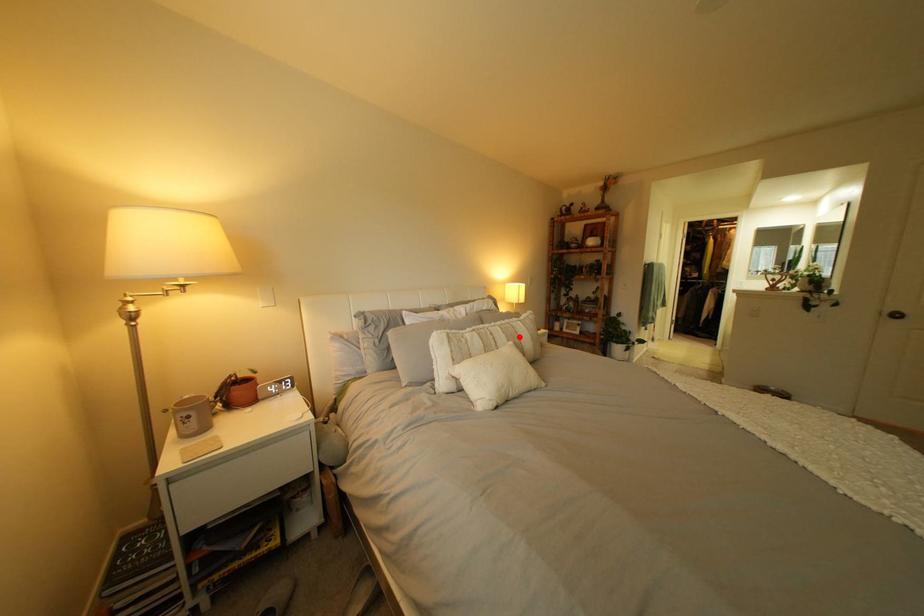
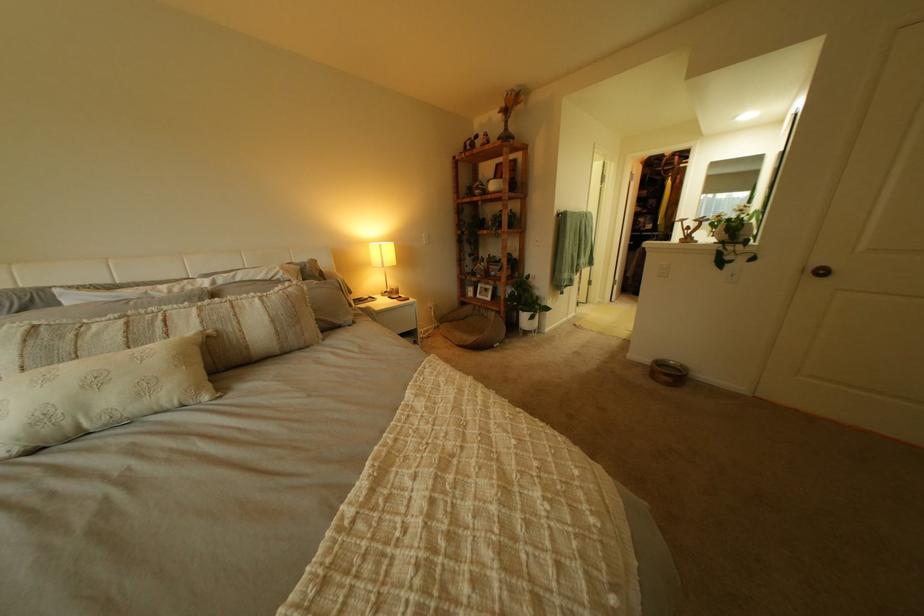
Locate, in the second image, the point that corresponds to the highlighted location in the first image.

(213, 323)